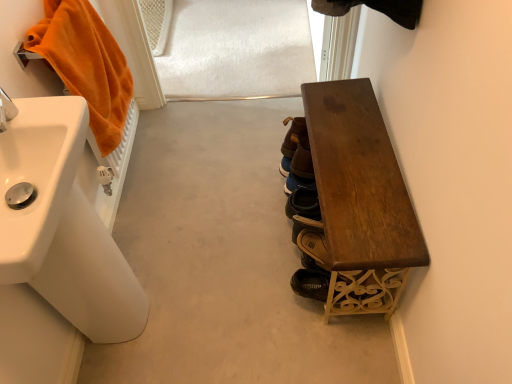
Locate an element on the screen. This screenshot has height=384, width=512. free space that is to the left of dark wood bench at right is located at coordinates (222, 242).